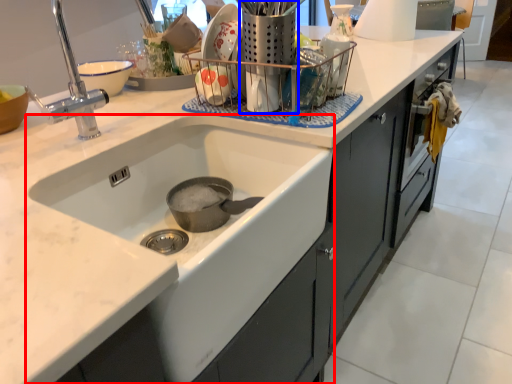
Question: Which point is further to the camera, sink (highlighted by a red box) or appliance (highlighted by a blue box)?

Choices:
 (A) sink
 (B) appliance

Answer: (B)